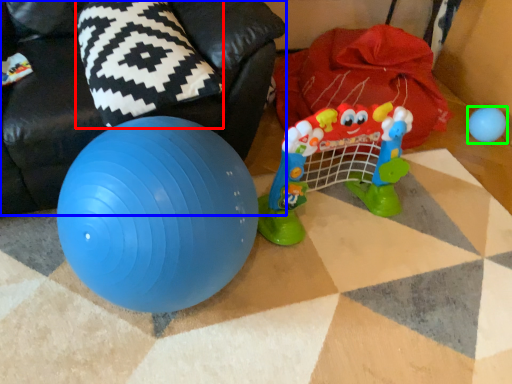
Question: Which object is the farthest from pillow (highlighted by a red box)? Choose among these: bean bag chair (highlighted by a blue box) or toy (highlighted by a green box).

Choices:
 (A) bean bag chair
 (B) toy

Answer: (B)